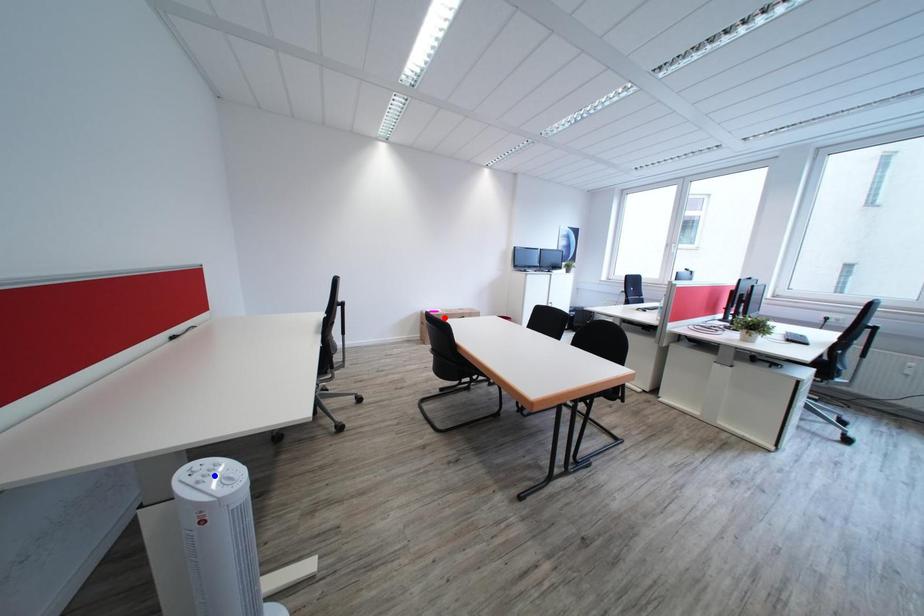
Question: Two points are marked on the image. Which point is closer to the camera?

Choices:
 (A) Blue point is closer.
 (B) Red point is closer.

Answer: (A)